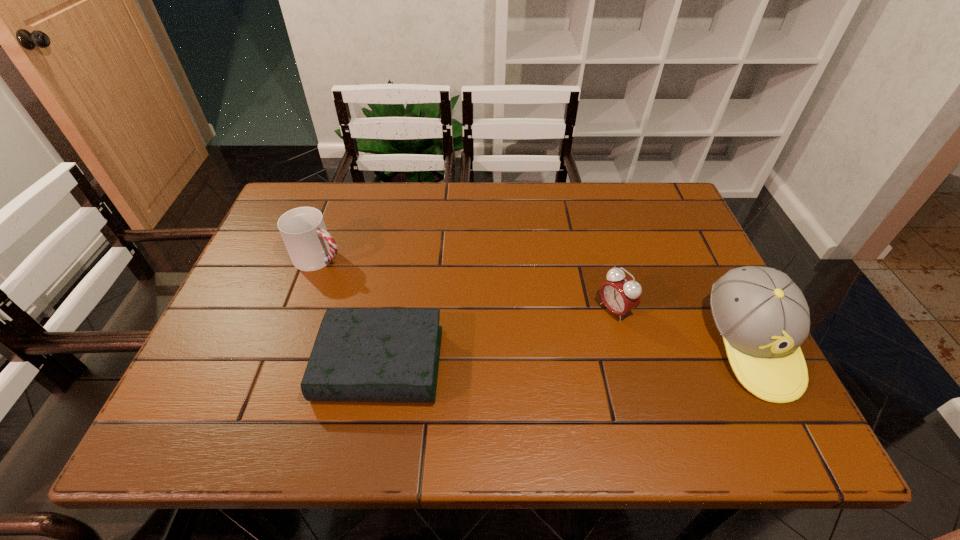
Locate an element on the screen. The image size is (960, 540). free space on the desktop that is between the shortest object and the tallest object and is positioned on the handle side of the leftmost object is located at coordinates (543, 356).

Identify the location of free spot on the desktop that is between the shortest object and the tallest object and is positioned on the clock face of the alarm clock. (539, 356).